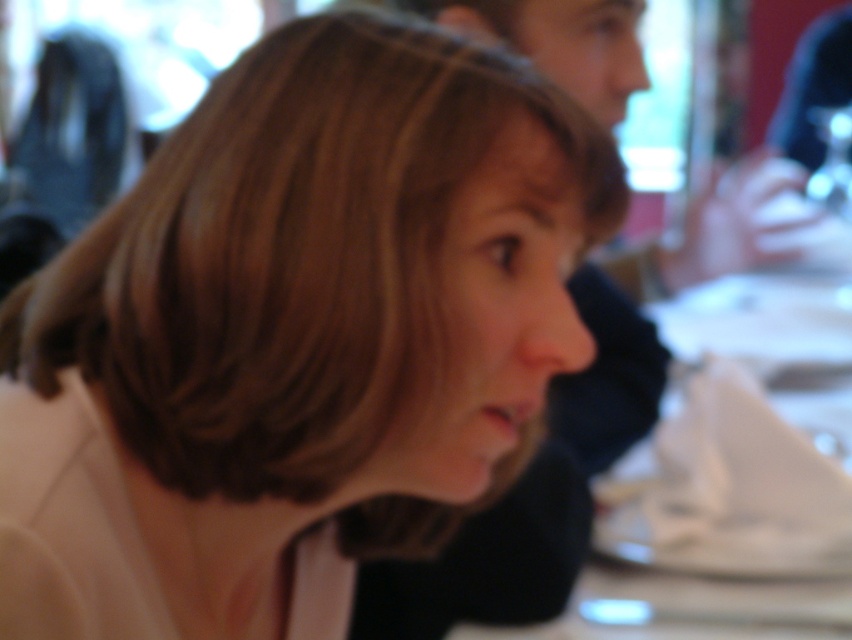
This screenshot has width=852, height=640. Find the location of `smooth beige hair at center`. smooth beige hair at center is located at coordinates (297, 298).

Is smooth beige hair at center thinner than white fabric table at center?

Yes, smooth beige hair at center is thinner than white fabric table at center.

Between point (232, 134) and point (661, 616), which one is positioned in front?

Point (232, 134) is more forward.

The width and height of the screenshot is (852, 640). I want to click on smooth beige hair at center, so click(297, 298).